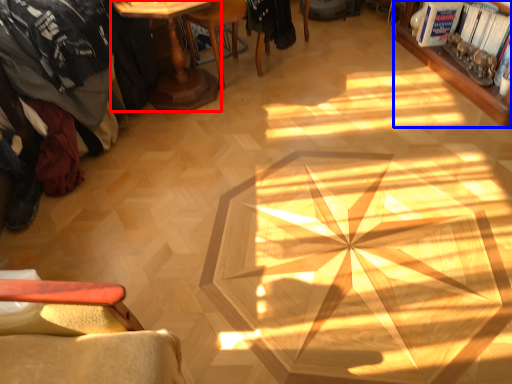
Question: Among these objects, which one is nearest to the camera, table (highlighted by a red box) or bookcase (highlighted by a blue box)?

Choices:
 (A) table
 (B) bookcase

Answer: (A)